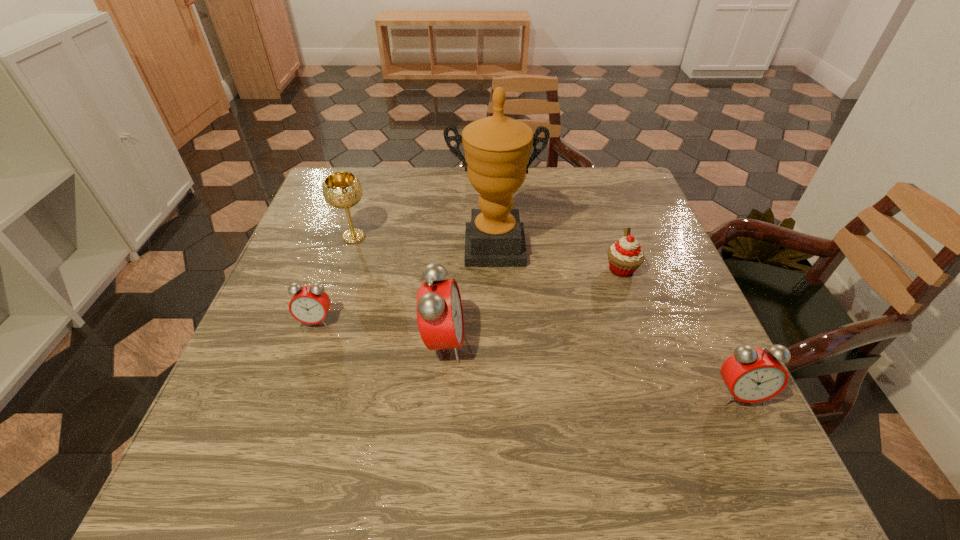
Identify the location of vacant point that satisfies the following two spatial constraints: 1. at the front of the tallest object with handles; 2. on the left side of the fifth object from left to right. (494, 269).